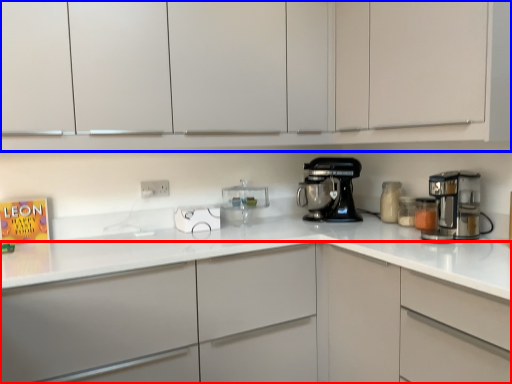
Question: Which object appears closest to the camera in this image, cabinetry (highlighted by a red box) or cabinetry (highlighted by a blue box)?

Choices:
 (A) cabinetry
 (B) cabinetry

Answer: (B)